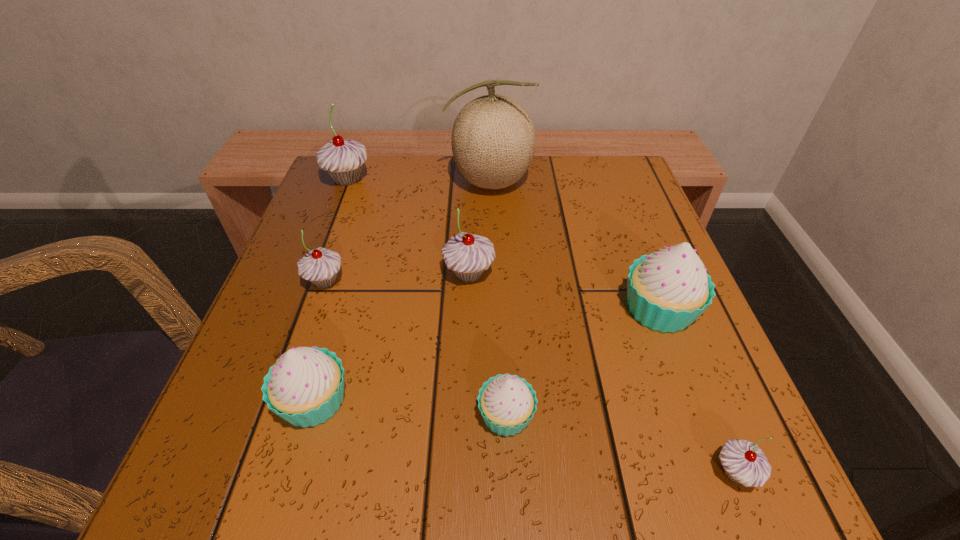
Where is `cantaloup`? This screenshot has height=540, width=960. cantaloup is located at coordinates (493, 139).

What are the coordinates of `the farthest cupcake` in the screenshot? It's located at (342, 159).

This screenshot has height=540, width=960. In order to click on the tallest cupcake in this screenshot , I will do `click(342, 159)`.

What are the coordinates of `the third gray cupcake from left to right` in the screenshot? It's located at (467, 255).

Where is `the farthest white cupcake`? The width and height of the screenshot is (960, 540). the farthest white cupcake is located at coordinates (668, 290).

The image size is (960, 540). In order to click on the biggest white cupcake in this screenshot , I will do `click(668, 290)`.

At what (x,y) coordinates should I click in order to perform the action: click on the second smallest gray cupcake. Please return your answer as a coordinate pair (x, y). This screenshot has height=540, width=960. Looking at the image, I should click on (320, 266).

Where is `the leftmost white cupcake`? the leftmost white cupcake is located at coordinates (305, 387).

Where is `the second white cupcake from left to right`? This screenshot has height=540, width=960. the second white cupcake from left to right is located at coordinates (507, 403).

You are a GUI agent. You are given a task and a screenshot of the screen. Output one action in this format:
    pyautogui.click(x=<x>, y=<y>)
    Task: Click on the rightmost gray cupcake
    This screenshot has width=960, height=540.
    Given the screenshot: What is the action you would take?
    pyautogui.click(x=743, y=462)